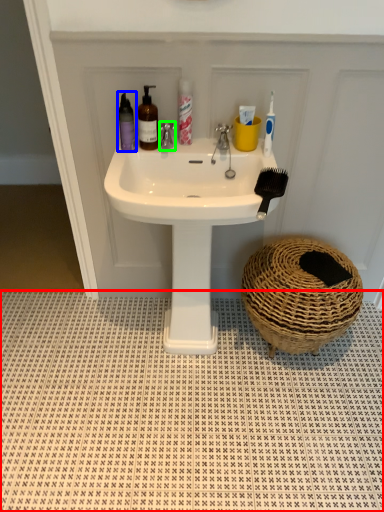
Question: Which is farther away from tile (highlighted by a red box)? mouthwash (highlighted by a blue box) or tap (highlighted by a green box)?

Choices:
 (A) mouthwash
 (B) tap

Answer: (B)